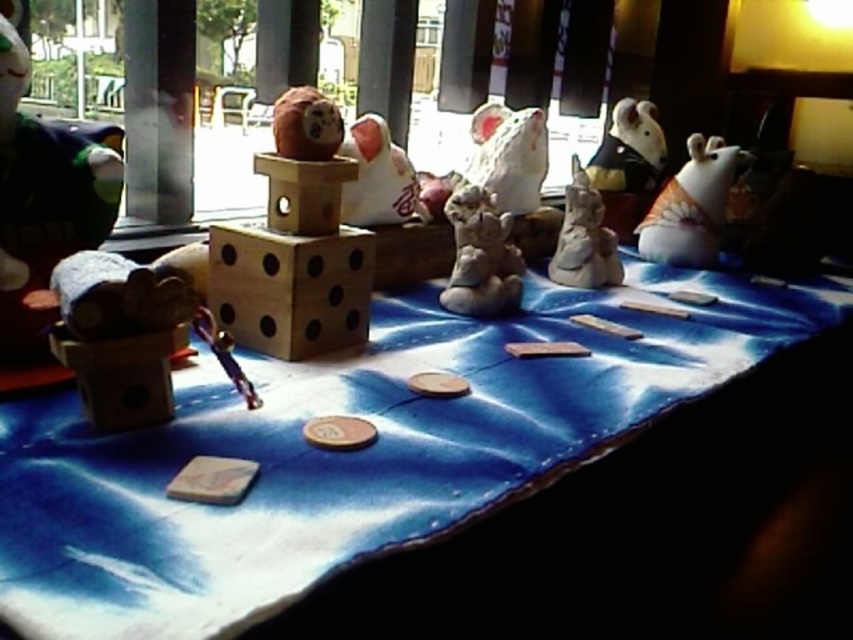
Is white glossy bear at upper right further to camera compared to white glossy bear at center?

Yes, it is.

Does white glossy bear at upper right have a larger size compared to white glossy bear at center?

Yes.

Between point (703, 252) and point (469, 282), which one is positioned in front?

Point (469, 282)

You are a GUI agent. You are given a task and a screenshot of the screen. Output one action in this format:
    pyautogui.click(x=<x>, y=<y>)
    Task: Click on the white glossy bear at upper right
    The height and width of the screenshot is (640, 853).
    Given the screenshot: What is the action you would take?
    pyautogui.click(x=692, y=205)

Can you confirm if matte brown bear at left is positioned below white glossy bear at center?

Actually, matte brown bear at left is above white glossy bear at center.

Based on the photo, can you confirm if matte brown bear at left is shorter than white glossy bear at center?

Incorrect, matte brown bear at left's height does not fall short of white glossy bear at center's.

Is point (21, 355) in front of point (457, 257)?

Yes, it is.

The width and height of the screenshot is (853, 640). I want to click on matte brown bear at left, so click(x=42, y=198).

Can you confirm if blue fabric table at center is smaller than white glossy statue at center?

No.

Between point (729, 349) and point (612, 276), which one is positioned behind?

Positioned behind is point (612, 276).

What are the coordinates of `blue fabric table at center` in the screenshot? It's located at (280, 531).